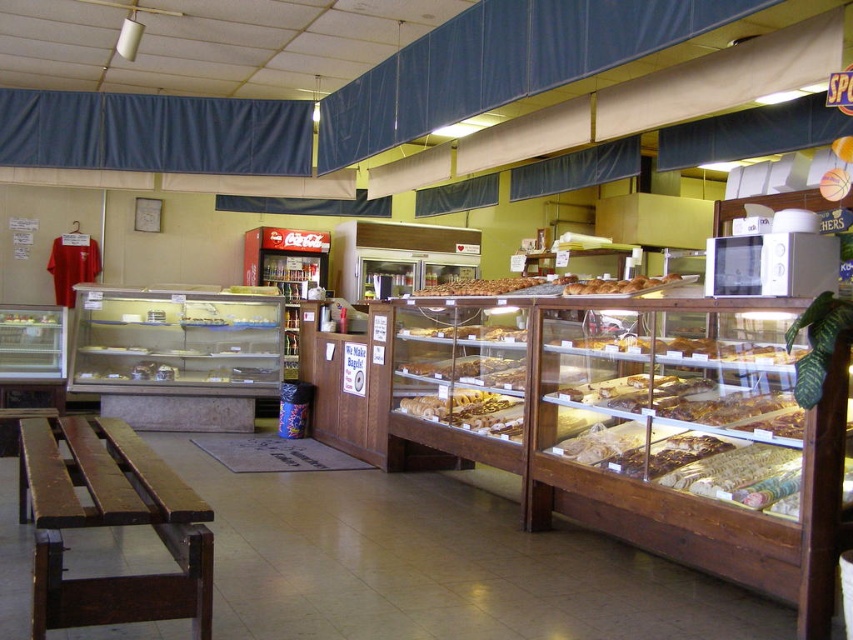
This screenshot has width=853, height=640. What do you see at coordinates (479, 285) in the screenshot?
I see `brown matte bread at center` at bounding box center [479, 285].

Find the location of `brown matte bread at center`. brown matte bread at center is located at coordinates (479, 285).